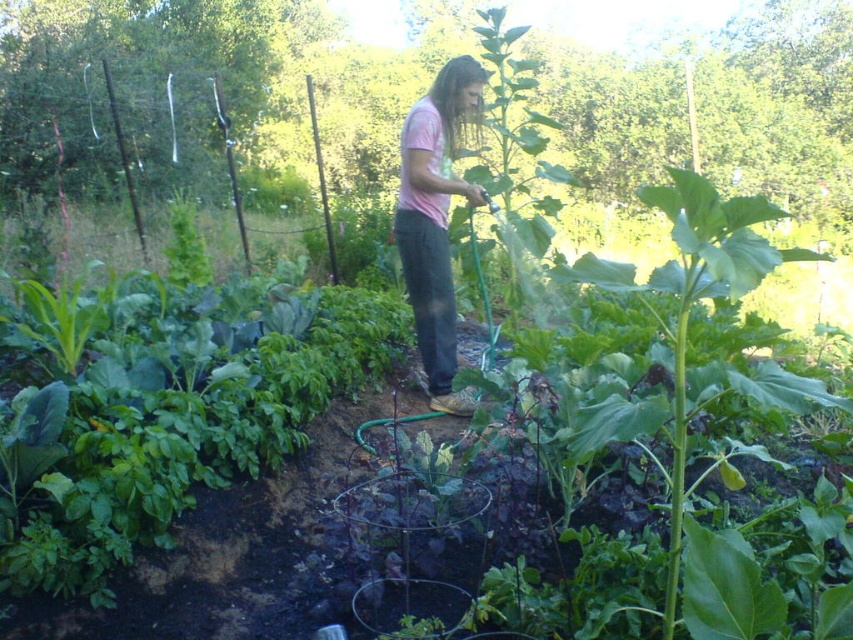
Question: Does green leafy vegetables at center appear on the left side of pink matte shirt at center?

Choices:
 (A) no
 (B) yes

Answer: (A)

Question: Which of the following is the farthest from the observer?

Choices:
 (A) pink matte shirt at center
 (B) green leafy vegetables at center

Answer: (A)

Question: Which object appears closest to the camera in this image?

Choices:
 (A) green leafy vegetables at center
 (B) pink matte shirt at center

Answer: (A)

Question: Can you confirm if green leafy vegetables at center is positioned above pink matte shirt at center?

Choices:
 (A) no
 (B) yes

Answer: (A)

Question: Is green leafy vegetables at center above pink matte shirt at center?

Choices:
 (A) yes
 (B) no

Answer: (B)